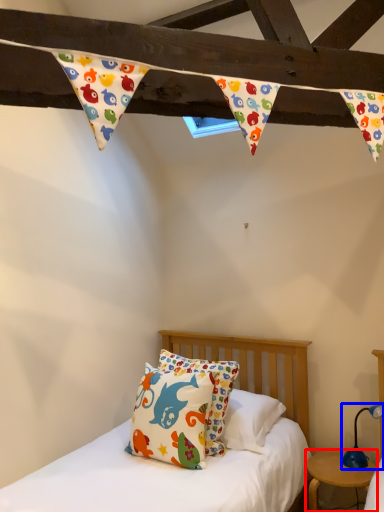
Question: Which object is closer to the camera taking this photo, nightstand (highlighted by a red box) or table lamp (highlighted by a blue box)?

Choices:
 (A) nightstand
 (B) table lamp

Answer: (A)